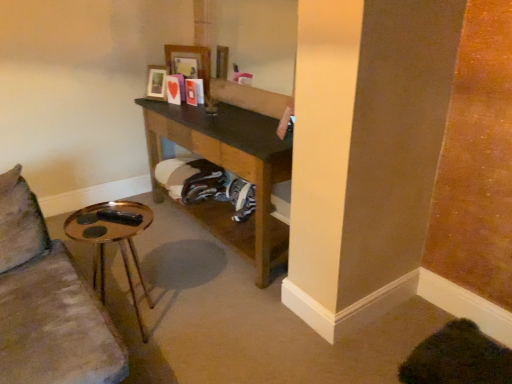
Question: Can you confirm if wooden photo frame at upper center, the 2th picture frame from the right, is positioned to the left of wooden picture frame at upper center, placed as the first picture frame when sorted from right to left?

Choices:
 (A) yes
 (B) no

Answer: (A)

Question: Is wooden photo frame at upper center, the 1th picture frame in the left-to-right sequence, thinner than wooden picture frame at upper center, acting as the second picture frame starting from the left?

Choices:
 (A) yes
 (B) no

Answer: (B)

Question: Can you confirm if wooden photo frame at upper center, the 2th picture frame from the right, is bigger than wooden picture frame at upper center, placed as the first picture frame when sorted from right to left?

Choices:
 (A) no
 (B) yes

Answer: (A)

Question: Could you tell me if wooden photo frame at upper center, the 2th picture frame from the right, is turned towards wooden picture frame at upper center, acting as the second picture frame starting from the left?

Choices:
 (A) no
 (B) yes

Answer: (A)

Question: Does wooden photo frame at upper center, the 2th picture frame from the right, have a smaller size compared to wooden picture frame at upper center, placed as the first picture frame when sorted from right to left?

Choices:
 (A) no
 (B) yes

Answer: (B)

Question: Considering the positions of wooden picture frame at upper center, placed as the first picture frame when sorted from right to left, and wooden photo frame at upper center, the 2th picture frame from the right, in the image, is wooden picture frame at upper center, placed as the first picture frame when sorted from right to left, wider or thinner than wooden photo frame at upper center, the 2th picture frame from the right,?

Choices:
 (A) wide
 (B) thin

Answer: (B)

Question: From the image's perspective, relative to wooden photo frame at upper center, the 2th picture frame from the right, is wooden picture frame at upper center, placed as the first picture frame when sorted from right to left, above or below?

Choices:
 (A) below
 (B) above

Answer: (B)

Question: Would you say wooden picture frame at upper center, acting as the second picture frame starting from the left, is to the left or to the right of wooden photo frame at upper center, the 2th picture frame from the right, in the picture?

Choices:
 (A) right
 (B) left

Answer: (A)

Question: Considering the positions of wooden picture frame at upper center, acting as the second picture frame starting from the left, and wooden photo frame at upper center, the 1th picture frame in the left-to-right sequence, in the image, is wooden picture frame at upper center, acting as the second picture frame starting from the left, bigger or smaller than wooden photo frame at upper center, the 1th picture frame in the left-to-right sequence,?

Choices:
 (A) small
 (B) big

Answer: (B)

Question: Is brown wooden shelf at center spatially inside wooden picture frame at upper center, acting as the second picture frame starting from the left, or outside of it?

Choices:
 (A) inside
 (B) outside

Answer: (B)

Question: In terms of width, does brown wooden shelf at center look wider or thinner when compared to wooden picture frame at upper center, acting as the second picture frame starting from the left?

Choices:
 (A) thin
 (B) wide

Answer: (B)

Question: Considering the positions of brown wooden shelf at center and wooden picture frame at upper center, acting as the second picture frame starting from the left, in the image, is brown wooden shelf at center bigger or smaller than wooden picture frame at upper center, acting as the second picture frame starting from the left,?

Choices:
 (A) small
 (B) big

Answer: (B)

Question: Would you say brown wooden shelf at center is to the left or to the right of wooden picture frame at upper center, placed as the first picture frame when sorted from right to left, in the picture?

Choices:
 (A) right
 (B) left

Answer: (A)

Question: Looking at the image, does wooden photo frame at upper center, the 2th picture frame from the right, seem bigger or smaller compared to gold metallic side table at lower left?

Choices:
 (A) small
 (B) big

Answer: (A)

Question: Considering their positions, is wooden photo frame at upper center, the 2th picture frame from the right, located in front of or behind gold metallic side table at lower left?

Choices:
 (A) behind
 (B) front

Answer: (A)